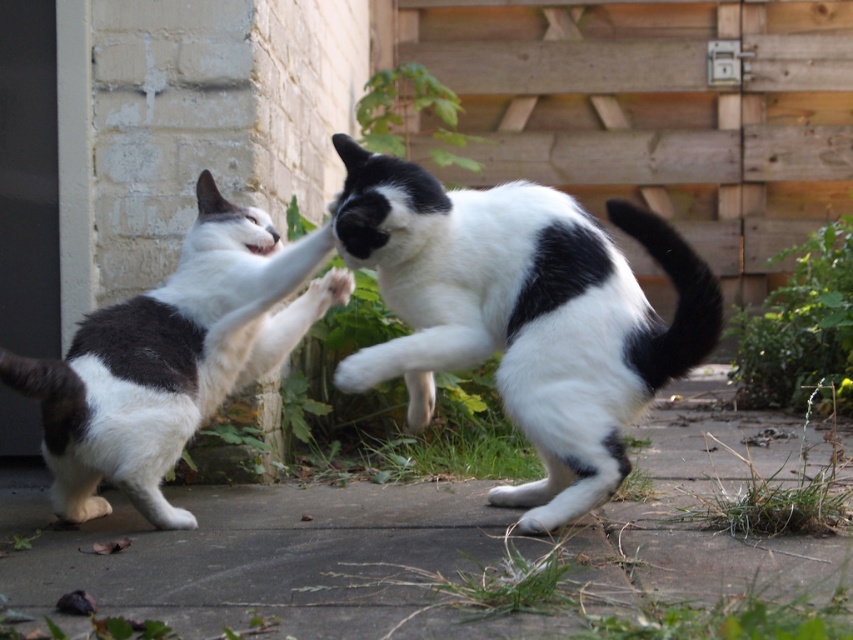
Question: Observing the image, what is the correct spatial positioning of black and white fur cat at center in reference to white fur cat at left?

Choices:
 (A) above
 (B) below

Answer: (B)

Question: Which of the following is the farthest from the observer?

Choices:
 (A) (646, 308)
 (B) (138, 358)

Answer: (B)

Question: Does black and white fur cat at center come behind white fur cat at left?

Choices:
 (A) no
 (B) yes

Answer: (A)

Question: Is the position of black and white fur cat at center less distant than that of white fur cat at left?

Choices:
 (A) yes
 (B) no

Answer: (A)